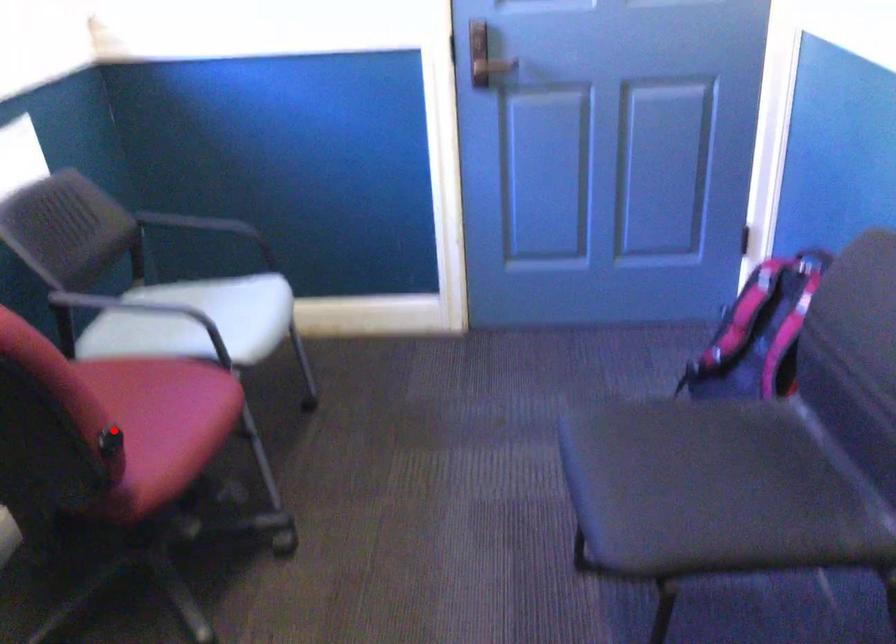
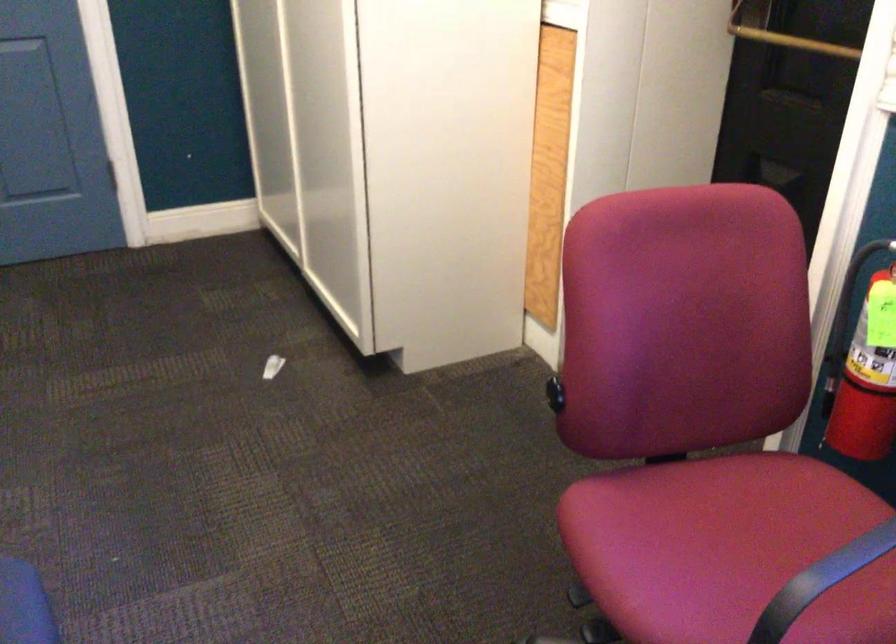
Where in the second image is the point corresponding to the highlighted location from the first image?

(555, 393)